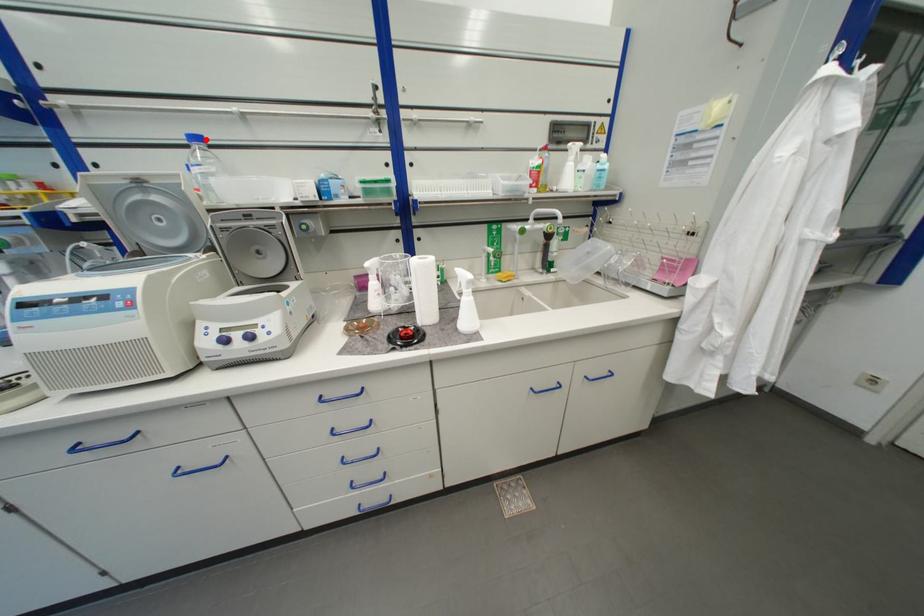
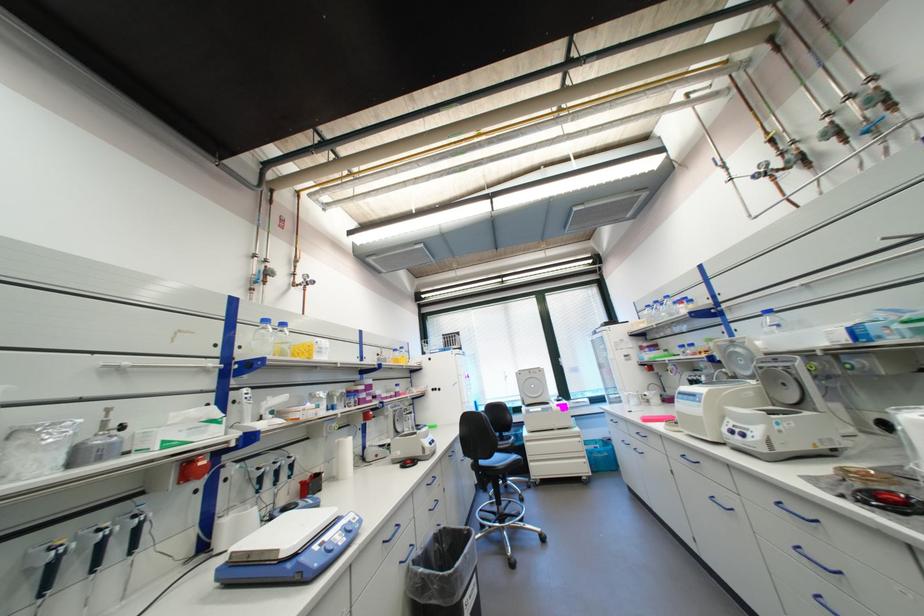
The point at the highlighted location is marked in the first image. Where is the corresponding point in the second image?

(776, 312)